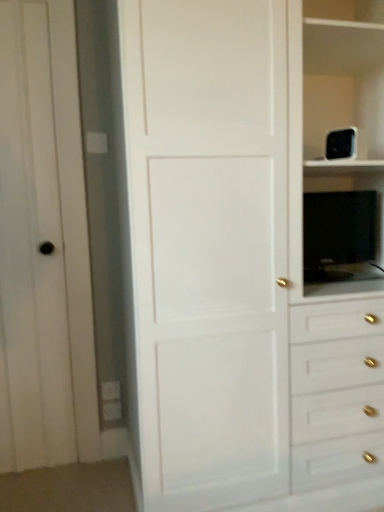
Question: Can you confirm if white matte door at left is shorter than black glossy tv at right?

Choices:
 (A) no
 (B) yes

Answer: (A)

Question: From the image's perspective, is white matte door at left beneath black glossy tv at right?

Choices:
 (A) no
 (B) yes

Answer: (B)

Question: Can you confirm if white matte door at left is taller than black glossy tv at right?

Choices:
 (A) no
 (B) yes

Answer: (B)

Question: Is white matte door at left positioned far away from black glossy tv at right?

Choices:
 (A) yes
 (B) no

Answer: (A)

Question: From the image's perspective, is white matte door at left on black glossy tv at right?

Choices:
 (A) no
 (B) yes

Answer: (A)

Question: From a real-world perspective, is white matte door at center above or below black glossy tv at right?

Choices:
 (A) above
 (B) below

Answer: (A)

Question: Visually, is white matte door at center positioned to the left or to the right of black glossy tv at right?

Choices:
 (A) right
 (B) left

Answer: (B)

Question: Do you think white matte door at center is within black glossy tv at right, or outside of it?

Choices:
 (A) inside
 (B) outside

Answer: (B)

Question: Considering their positions, is white matte door at center located in front of or behind black glossy tv at right?

Choices:
 (A) front
 (B) behind

Answer: (A)

Question: Which is correct: white matte door at left is inside black glossy tv at right, or outside of it?

Choices:
 (A) inside
 (B) outside

Answer: (B)

Question: Is white matte door at left in front of or behind black glossy tv at right in the image?

Choices:
 (A) front
 (B) behind

Answer: (A)

Question: From the image's perspective, is white matte door at left positioned above or below black glossy tv at right?

Choices:
 (A) above
 (B) below

Answer: (B)

Question: Is white matte door at left taller or shorter than black glossy tv at right?

Choices:
 (A) short
 (B) tall

Answer: (B)

Question: Considering their positions, is white matte door at center located in front of or behind white matte door at left?

Choices:
 (A) front
 (B) behind

Answer: (A)

Question: Is white matte door at center bigger or smaller than white matte door at left?

Choices:
 (A) small
 (B) big

Answer: (B)